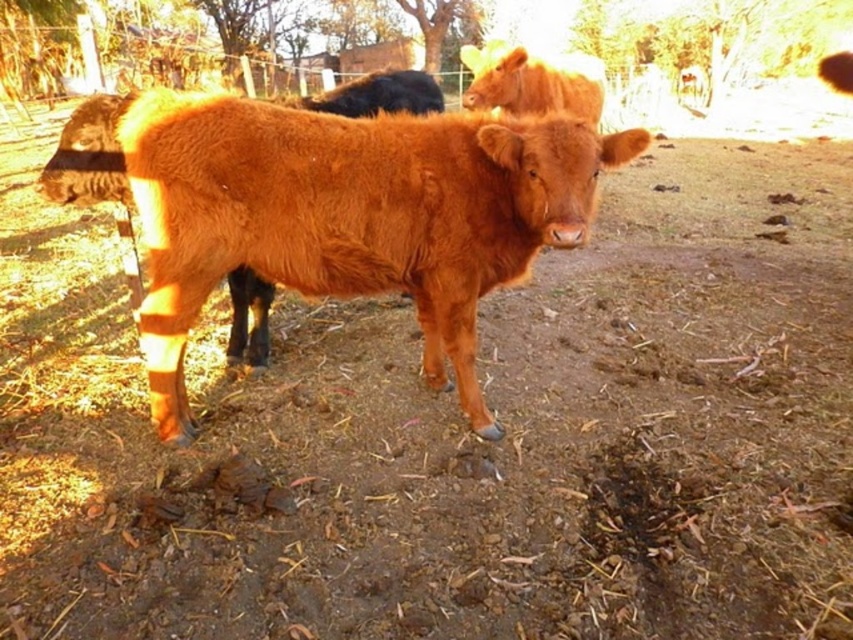
Is brown woolly bull at center positioned at the back of shiny brown bull at upper center?

That is False.

Is brown woolly bull at center smaller than shiny brown bull at upper center?

No.

Is point (560, 225) farther from viewer compared to point (541, 84)?

No, (560, 225) is in front of (541, 84).

Identify the location of brown woolly bull at center. point(350,216).